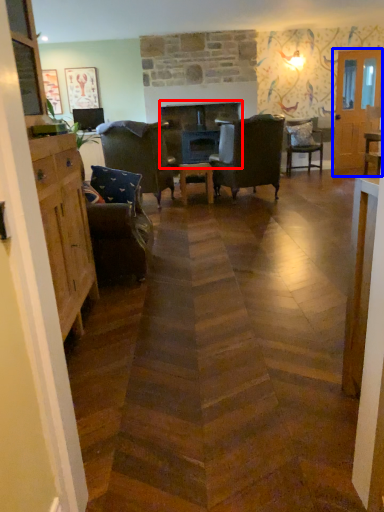
Question: Which point is closer to the camera, fireplace (highlighted by a red box) or glass door (highlighted by a blue box)?

Choices:
 (A) fireplace
 (B) glass door

Answer: (A)